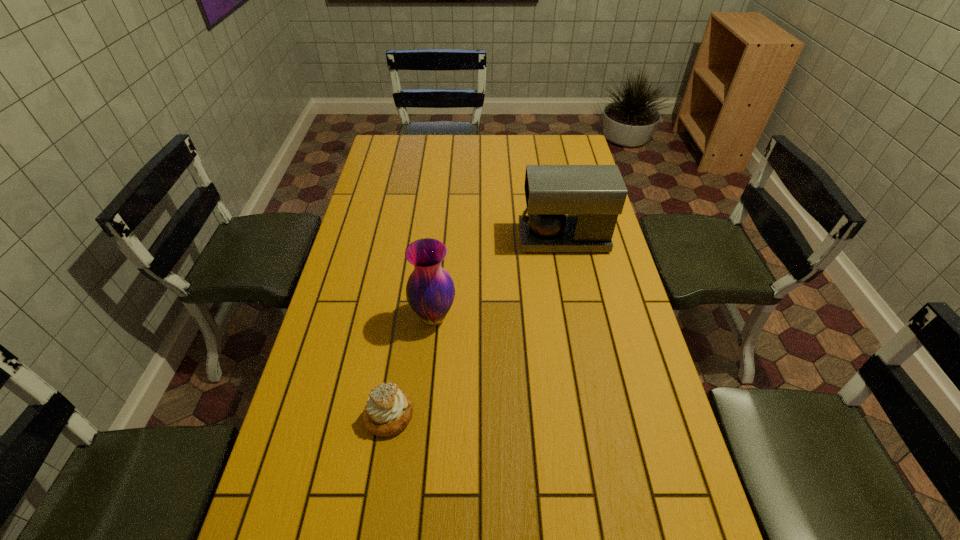
At what (x,y) coordinates should I click in order to perform the action: click on object that is at the right edge. Please return your answer as a coordinate pair (x, y). The height and width of the screenshot is (540, 960). Looking at the image, I should click on (570, 208).

In order to click on free spot at the far edge of the desktop in this screenshot , I will do `click(480, 150)`.

Identify the location of vacant space at the left edge of the desktop. The width and height of the screenshot is (960, 540). (372, 355).

In order to click on vacant space at the right edge in this screenshot , I will do `click(570, 252)`.

At what (x,y) coordinates should I click in order to perform the action: click on vacant space at the far left corner. Please return your answer as a coordinate pair (x, y). This screenshot has height=540, width=960. Looking at the image, I should click on (415, 143).

Locate an element on the screen. free spot between the second farthest object and the pastry is located at coordinates (412, 366).

At what (x,y) coordinates should I click in order to perform the action: click on unoccupied position between the pastry and the rightmost object. Please return your answer as a coordinate pair (x, y). Looking at the image, I should click on (476, 327).

Find the location of a particular element. This screenshot has height=540, width=960. vacant point located between the shortest object and the coffee maker is located at coordinates (476, 327).

Locate an element on the screen. free space between the farthest object and the shortest object is located at coordinates (476, 327).

Locate an element on the screen. The width and height of the screenshot is (960, 540). unoccupied position between the coffee maker and the nearest object is located at coordinates (476, 327).